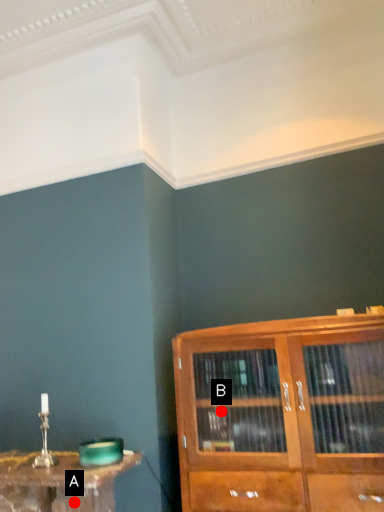
Question: Two points are circled on the image, labeled by A and B beside each circle. Which point is further to the camera?

Choices:
 (A) A is further
 (B) B is further

Answer: (A)